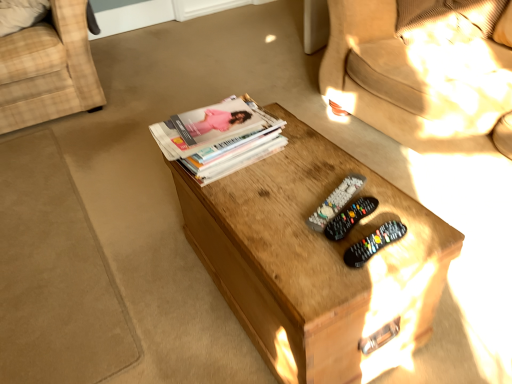
Find the location of a particular element. The image size is (512, 384). vacant space to the right of black plastic remote at center, marked as the 1th remote control in a back-to-front arrangement is located at coordinates (401, 206).